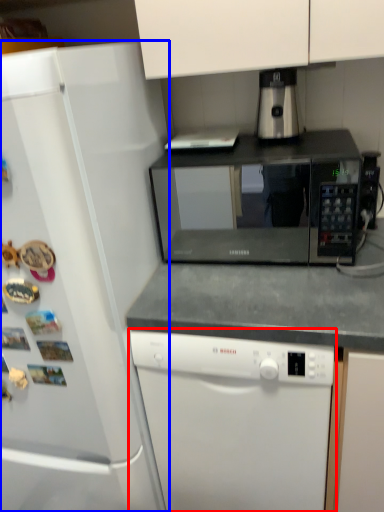
Question: Among these objects, which one is nearest to the camera, dishwasher (highlighted by a red box) or refrigerator (highlighted by a blue box)?

Choices:
 (A) dishwasher
 (B) refrigerator

Answer: (B)